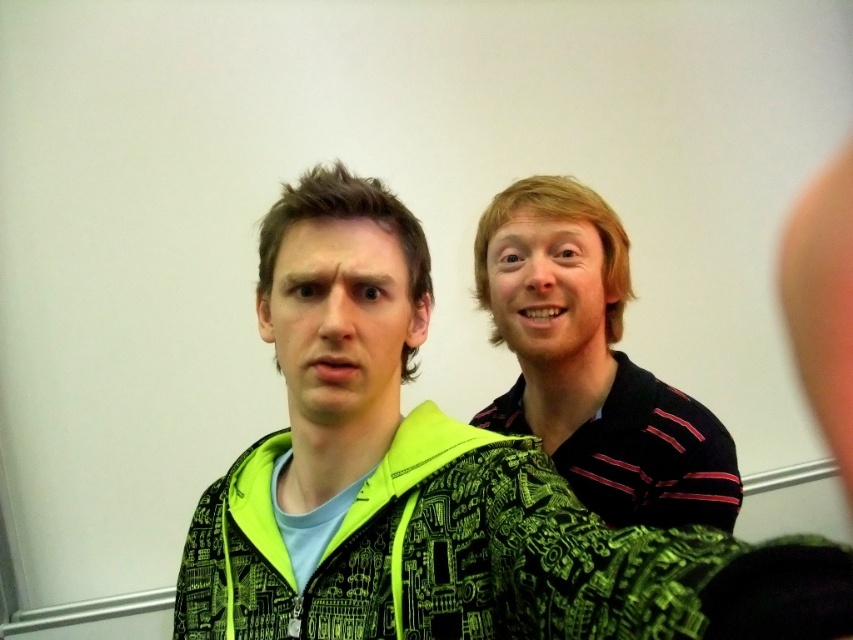
Question: Does striped cotton shirt at right have a larger size compared to matte green jacket at center?

Choices:
 (A) no
 (B) yes

Answer: (B)

Question: Which object is farther from the camera taking this photo?

Choices:
 (A) matte green jacket at center
 (B) smooth blonde hair at upper right

Answer: (B)

Question: Can you confirm if matte green jacket at center is positioned to the right of smooth blonde hair at upper right?

Choices:
 (A) yes
 (B) no

Answer: (B)

Question: Which point is closer to the camera taking this photo?

Choices:
 (A) (361, 392)
 (B) (592, 392)

Answer: (A)

Question: Estimate the real-world distances between objects in this image. Which object is farther from the matte green jacket at center?

Choices:
 (A) striped cotton shirt at right
 (B) smooth blonde hair at upper right

Answer: (A)

Question: Is striped cotton shirt at right smaller than matte green jacket at center?

Choices:
 (A) no
 (B) yes

Answer: (A)